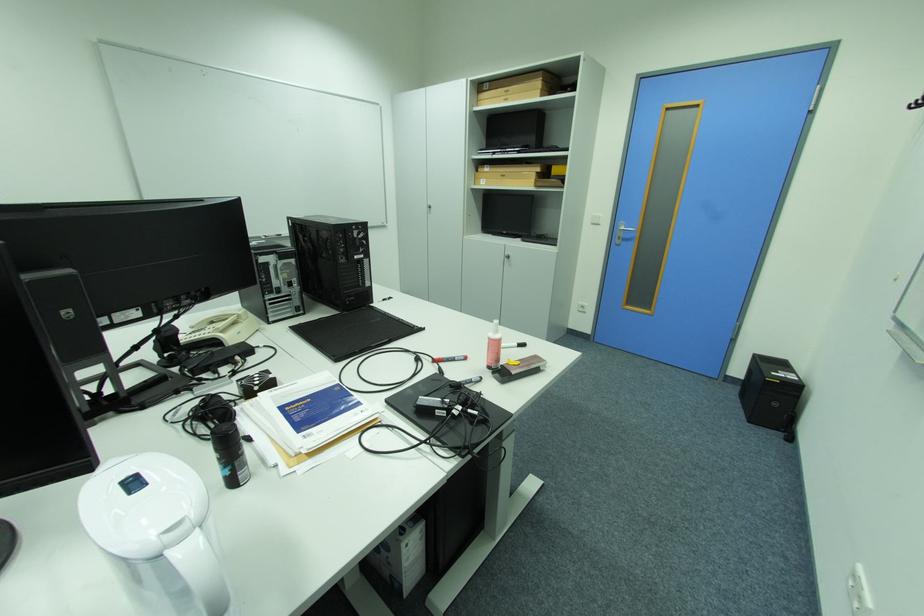
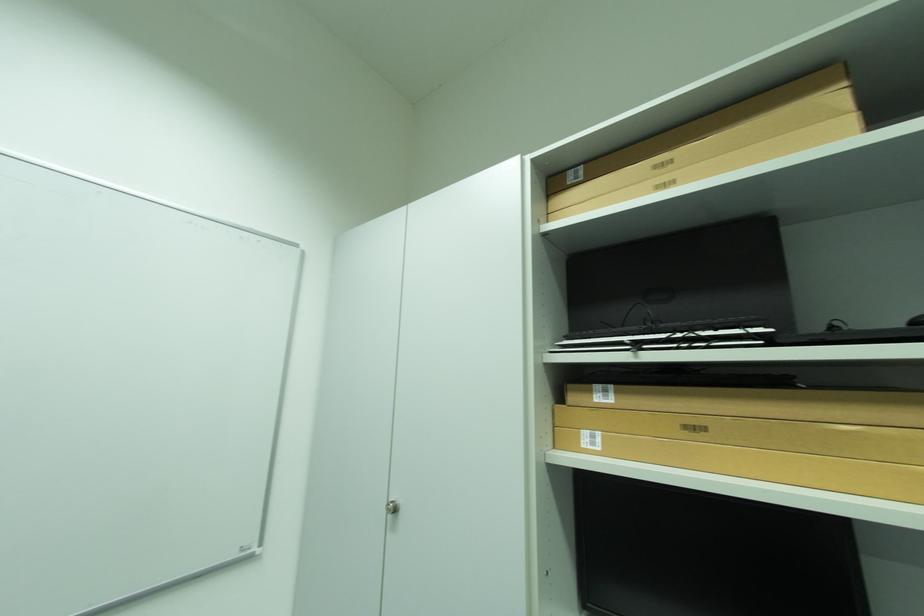
Find the pixel in the second image that matches (x=490, y=180) in the first image.

(593, 434)